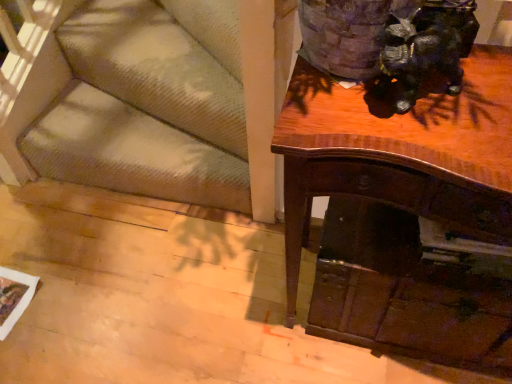
Question: Considering the relative sizes of wooden drawer at lower right and textured beige carpet at lower left in the image provided, is wooden drawer at lower right taller than textured beige carpet at lower left?

Choices:
 (A) yes
 (B) no

Answer: (A)

Question: Is wooden drawer at lower right bigger than textured beige carpet at lower left?

Choices:
 (A) no
 (B) yes

Answer: (A)

Question: Could textured beige carpet at lower left be considered to be inside wooden drawer at lower right?

Choices:
 (A) no
 (B) yes

Answer: (A)

Question: Does wooden drawer at lower right appear on the right side of textured beige carpet at lower left?

Choices:
 (A) yes
 (B) no

Answer: (A)

Question: Is wooden drawer at lower right looking in the opposite direction of textured beige carpet at lower left?

Choices:
 (A) yes
 (B) no

Answer: (B)

Question: Considering the relative sizes of wooden drawer at lower right and textured beige carpet at lower left in the image provided, is wooden drawer at lower right shorter than textured beige carpet at lower left?

Choices:
 (A) no
 (B) yes

Answer: (A)

Question: Is shiny brown desk at upper right positioned with its back to shiny black statue at upper right?

Choices:
 (A) yes
 (B) no

Answer: (B)

Question: From the image's perspective, is shiny brown desk at upper right located above shiny black statue at upper right?

Choices:
 (A) no
 (B) yes

Answer: (A)

Question: Would you consider shiny brown desk at upper right to be distant from shiny black statue at upper right?

Choices:
 (A) no
 (B) yes

Answer: (A)

Question: Is shiny brown desk at upper right to the right of shiny black statue at upper right from the viewer's perspective?

Choices:
 (A) no
 (B) yes

Answer: (B)

Question: Is shiny brown desk at upper right not within shiny black statue at upper right?

Choices:
 (A) no
 (B) yes

Answer: (B)

Question: Is the depth of shiny brown desk at upper right greater than that of shiny black statue at upper right?

Choices:
 (A) no
 (B) yes

Answer: (A)

Question: Does shiny brown desk at upper right lie in front of wooden drawer at lower right?

Choices:
 (A) yes
 (B) no

Answer: (A)